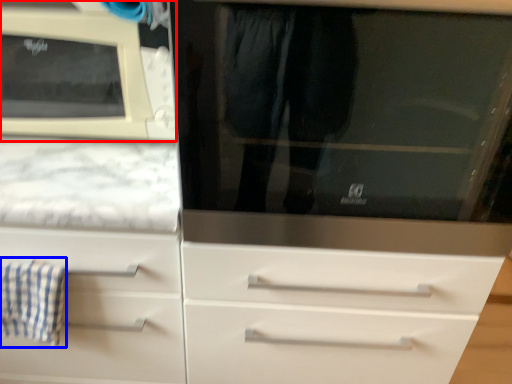
Question: Among these objects, which one is nearest to the camera, microwave oven (highlighted by a red box) or bath towel (highlighted by a blue box)?

Choices:
 (A) microwave oven
 (B) bath towel

Answer: (A)